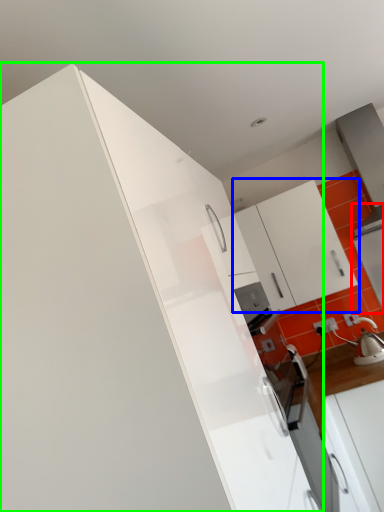
Question: Which object is positioned closest to appliance (highlighted by a red box)? Select from cabinetry (highlighted by a blue box) and cabinetry (highlighted by a green box).

Choices:
 (A) cabinetry
 (B) cabinetry

Answer: (A)